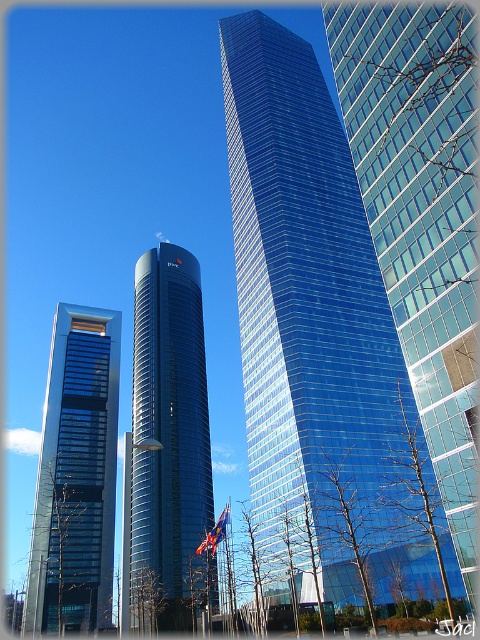
Between point (158, 448) and point (105, 400), which one is positioned behind?

Positioned behind is point (105, 400).

Can you confirm if smooth glass tower at center is positioned below matte glass skyscraper at left?

Actually, smooth glass tower at center is above matte glass skyscraper at left.

Between point (205, 426) and point (62, 518), which one is positioned behind?

Positioned behind is point (205, 426).

Image resolution: width=480 pixels, height=640 pixels. I want to click on smooth glass tower at center, so click(167, 449).

Is point (158, 624) positioned behind point (206, 536)?

No, (158, 624) is in front of (206, 536).

Does point (192, 492) lie in front of point (226, 532)?

No.

This screenshot has width=480, height=640. Identify the location of smooth glass tower at center. (167, 449).

Does glassy blue skyscraper at center have a lesser width compared to blue fabric flag at center?

In fact, glassy blue skyscraper at center might be wider than blue fabric flag at center.

This screenshot has width=480, height=640. Identify the location of glassy blue skyscraper at center. (312, 324).